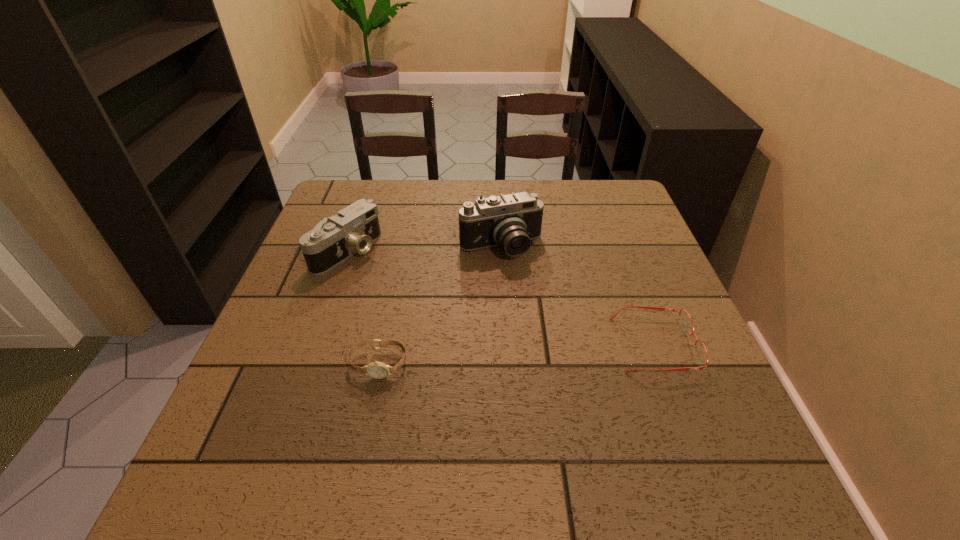
You are a GUI agent. You are given a task and a screenshot of the screen. Output one action in this format:
    pyautogui.click(x=<x>, y=<y>)
    Task: Click on the vacant space that's between the watch and the second tallest object
    The height and width of the screenshot is (540, 960).
    Given the screenshot: What is the action you would take?
    363,307

Locate an element on the screen. The height and width of the screenshot is (540, 960). the third closest object to the shorter camera is located at coordinates (686, 323).

Locate which object is the second closest to the third object from left to right. Please provide its 2D coordinates. Your answer should be formatted as a tuple, i.e. [(x, y)], where the tuple contains the x and y coordinates of a point satisfying the conditions above.

[(353, 230)]

At what (x,y) coordinates should I click in order to perform the action: click on free spot that satisfies the following two spatial constraints: 1. on the front side of the second tallest object; 2. on the lenses of the spectacles. Please return your answer as a coordinate pair (x, y). Looking at the image, I should click on (315, 345).

Locate an element on the screen. This screenshot has height=540, width=960. vacant space that satisfies the following two spatial constraints: 1. on the front side of the shorter camera; 2. on the lenses of the spectacles is located at coordinates (315, 345).